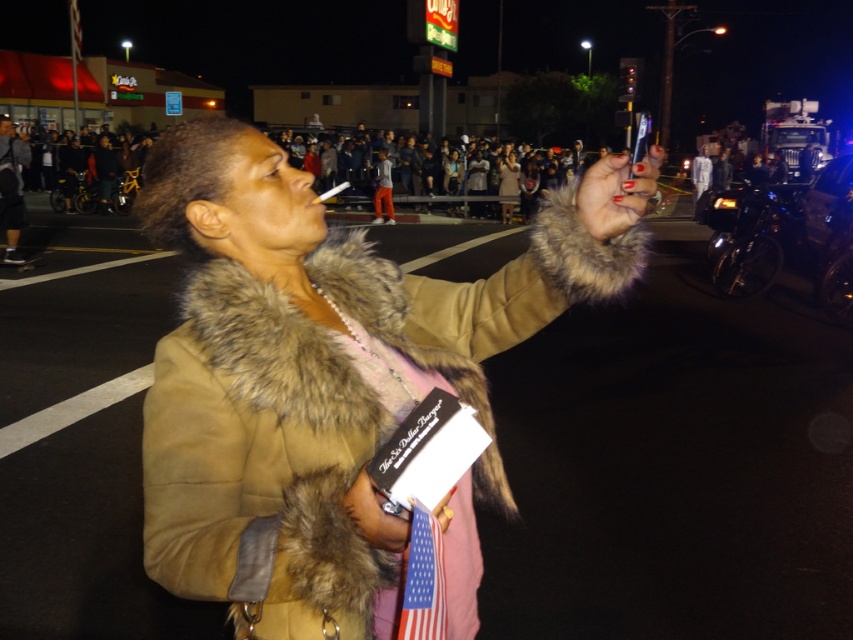
In the scene shown: You are a fashion designer observing the scene. You notice the tan suede coat at center and the fur coat at center. Which coat is wider?

The tan suede coat at center is wider than the fur coat at center according to the description.

Based on the scene description, which object is positioned to the left of the other? Please compare the tan suede coat at center and the white cotton shirt at upper center.

The tan suede coat at center is to the left of the white cotton shirt at upper center.

You are a fashion designer observing the scene. You notice the tan suede coat at center and the white cotton shirt at upper center. Which clothing item appears to be more narrow in width?

The tan suede coat at center is thinner than the white cotton shirt at upper center, so the tan suede coat at center is more narrow in width.